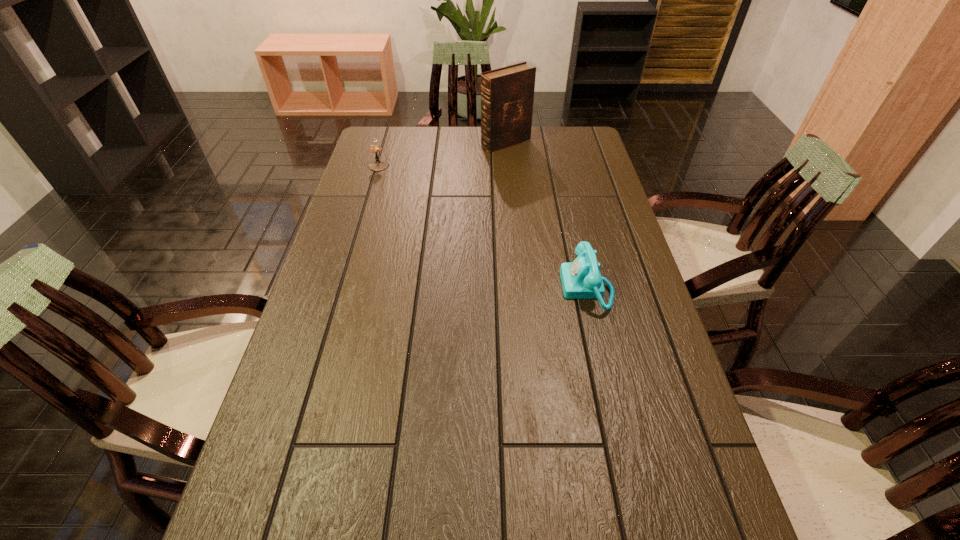
You are a GUI agent. You are given a task and a screenshot of the screen. Output one action in this format:
    pyautogui.click(x=<x>, y=<y>)
    Task: Click on the Bible
    The image size is (960, 540).
    Given the screenshot: What is the action you would take?
    pyautogui.click(x=507, y=94)

At what (x,y) coordinates should I click in order to perform the action: click on the second object from left to right. Please return your answer as a coordinate pair (x, y). The width and height of the screenshot is (960, 540). Looking at the image, I should click on (507, 94).

Locate an element on the screen. The height and width of the screenshot is (540, 960). the leftmost object is located at coordinates (378, 165).

Locate an element on the screen. Image resolution: width=960 pixels, height=540 pixels. candle holder is located at coordinates (378, 165).

Locate an element on the screen. This screenshot has height=540, width=960. telephone is located at coordinates (581, 279).

Find the location of a particular element. This screenshot has width=960, height=540. the nearest object is located at coordinates (581, 279).

Where is `vacant space positioned 0.100m on the right of the farthest object`? The width and height of the screenshot is (960, 540). vacant space positioned 0.100m on the right of the farthest object is located at coordinates (557, 143).

The image size is (960, 540). What are the coordinates of `vacant region located 0.100m on the front of the second farthest object` in the screenshot? It's located at (372, 187).

Where is `vacant space positioned 0.160m on the dial of the telephone`? This screenshot has width=960, height=540. vacant space positioned 0.160m on the dial of the telephone is located at coordinates (503, 288).

Identify the location of vacant area situated on the dial of the telephone. (492, 288).